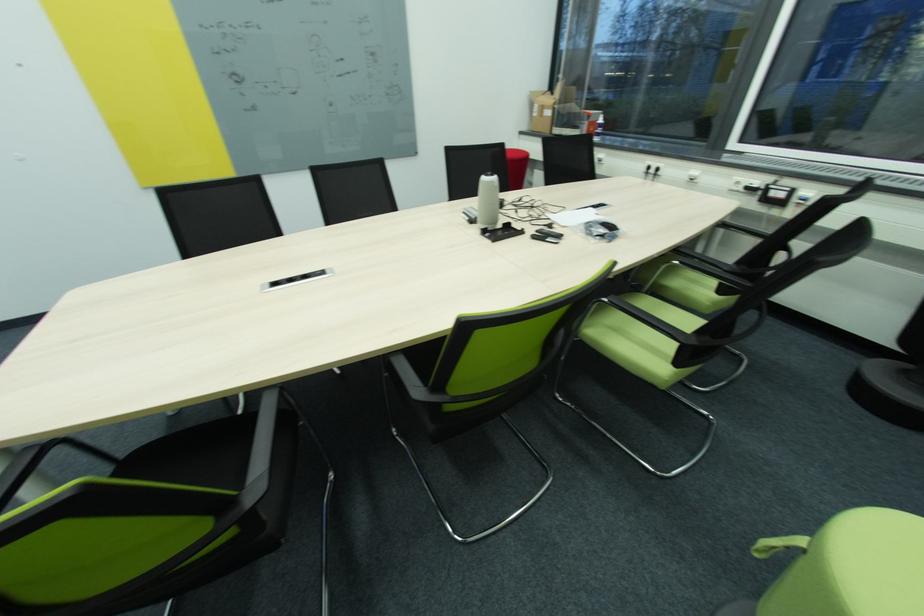
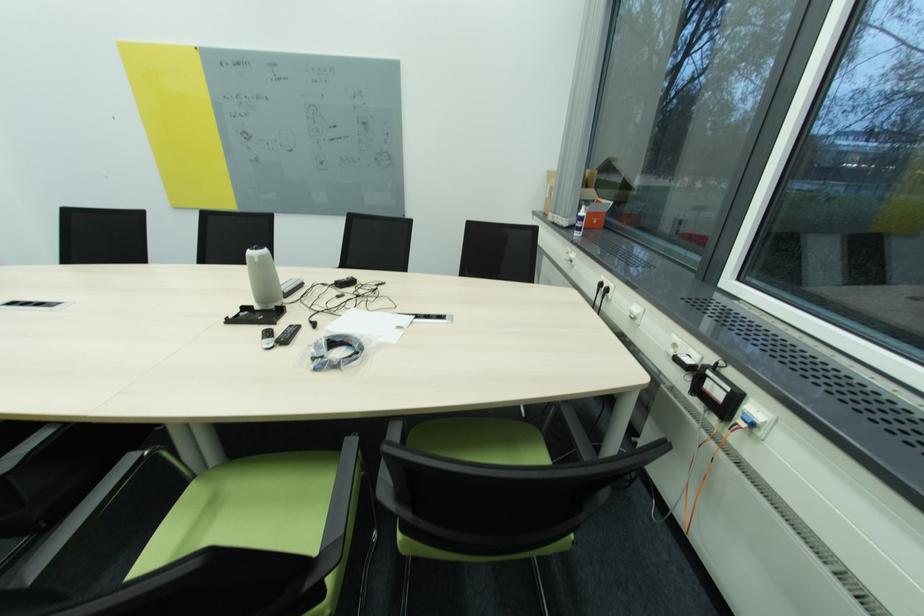
In the second image, find the point that corresponds to point 662,171 in the first image.

(612, 291)